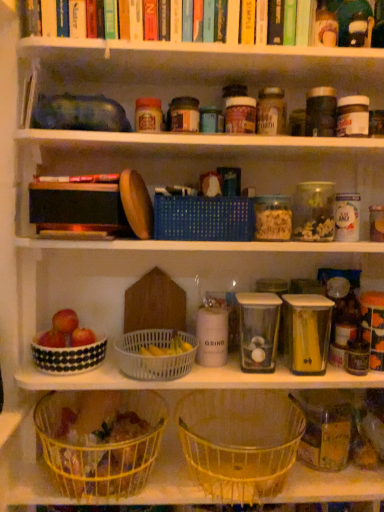
Identify the location of red matte apple at lower left, which is counted as the first apple, starting from the left. The width and height of the screenshot is (384, 512). (x=65, y=321).

What do you see at coordinates (65, 321) in the screenshot?
I see `red matte apple at lower left, which is counted as the first apple, starting from the left` at bounding box center [65, 321].

What are the coordinates of `translucent glass jar at lower right, the 1th glass jar in the right-to-left sequence` in the screenshot? It's located at (325, 428).

I want to click on white speckled ceramic bowl at lower left, so click(x=68, y=356).

The image size is (384, 512). Describe the element at coordinates (82, 337) in the screenshot. I see `red matte apple at lower left, acting as the second apple starting from the left` at that location.

Locate an element on the screen. red matte apple at lower left, arranged as the 1th apple when viewed from the right is located at coordinates (82, 337).

Locate an element on the screen. transparent plastic container at center, which is the third glass jar from right to left is located at coordinates (258, 331).

Find the location of `yellow wire basket at lower center, which ranks as the 2th basket in bottom-to-top order`. yellow wire basket at lower center, which ranks as the 2th basket in bottom-to-top order is located at coordinates (239, 441).

Could yellow wire basket at lower center, the first basket when ordered from bottom to top, be considered to be inside yellow wire basket at lower center, which ranks as the 2th basket in bottom-to-top order?

Actually, yellow wire basket at lower center, the first basket when ordered from bottom to top, is outside yellow wire basket at lower center, which ranks as the 2th basket in bottom-to-top order.

Find the location of a particular element. Image resolution: width=384 pixels, height=512 pixels. basket that is the 3rd one when counting rightward from the yellow wire basket at lower center, the first basket when ordered from bottom to top is located at coordinates (239, 441).

Considering the sizes of yellow wire basket at lower center, marked as the 3th basket in a top-to-bottom arrangement, and yellow wire basket at lower center, the first basket when ordered from bottom to top, in the image, is yellow wire basket at lower center, marked as the 3th basket in a top-to-bottom arrangement, wider or thinner than yellow wire basket at lower center, the first basket when ordered from bottom to top,?

Clearly, yellow wire basket at lower center, marked as the 3th basket in a top-to-bottom arrangement, has more width compared to yellow wire basket at lower center, the first basket when ordered from bottom to top.

From the image's perspective, is yellow wire basket at lower center, marked as the 3th basket in a top-to-bottom arrangement, beneath yellow wire basket at lower center, which ranks as the 4th basket in top-to-bottom order?

No, from the image's perspective, yellow wire basket at lower center, marked as the 3th basket in a top-to-bottom arrangement, is not beneath yellow wire basket at lower center, which ranks as the 4th basket in top-to-bottom order.

From the picture: From a real-world perspective, is white plastic basket at center, which appears as the 3th basket when ordered from the bottom, over yellow wire basket at lower center, which ranks as the 2th basket in bottom-to-top order?

Yes, from a real-world perspective, white plastic basket at center, which appears as the 3th basket when ordered from the bottom, is on top of yellow wire basket at lower center, which ranks as the 2th basket in bottom-to-top order.

Is white plastic basket at center, which appears as the 3th basket when ordered from the bottom, positioned far away from yellow wire basket at lower center, which ranks as the 2th basket in bottom-to-top order?

No, white plastic basket at center, which appears as the 3th basket when ordered from the bottom, is in close proximity to yellow wire basket at lower center, which ranks as the 2th basket in bottom-to-top order.

Which object is further away from the camera, white plastic basket at center, which appears as the 3th basket when ordered from the bottom, or yellow wire basket at lower center, which ranks as the 2th basket in bottom-to-top order?

white plastic basket at center, which appears as the 3th basket when ordered from the bottom.

From the image's perspective, starting from the yellow wire basket at lower center, which ranks as the 2th basket in bottom-to-top order, which basket is the 1st one above? Please provide its 2D coordinates.

[(153, 357)]

Looking at this image, can you confirm if red matte apple at lower left, which is counted as the first apple, starting from the left, is shorter than yellow wire basket at lower center, which ranks as the 4th basket in top-to-bottom order?

Yes, red matte apple at lower left, which is counted as the first apple, starting from the left, is shorter than yellow wire basket at lower center, which ranks as the 4th basket in top-to-bottom order.

Would you say red matte apple at lower left, which is counted as the first apple, starting from the left, is to the left or to the right of yellow wire basket at lower center, the first basket when ordered from bottom to top, in the picture?

From the image, it's evident that red matte apple at lower left, which is counted as the first apple, starting from the left, is to the left of yellow wire basket at lower center, the first basket when ordered from bottom to top.

Can yellow wire basket at lower center, the first basket when ordered from bottom to top, be found inside red matte apple at lower left, which is counted as the first apple, starting from the left?

No.

From the image's perspective, is red matte apple at lower left, which is counted as the first apple, starting from the left, positioned above or below yellow wire basket at lower center, the first basket when ordered from bottom to top?

Based on their image positions, red matte apple at lower left, which is counted as the first apple, starting from the left, is located above yellow wire basket at lower center, the first basket when ordered from bottom to top.

In the scene shown: Is transparent plastic container at center, which is the third glass jar from right to left, positioned behind clear plastic container at upper right, arranged as the 1th glass jar when viewed from the top?

Yes, the depth of transparent plastic container at center, which is the third glass jar from right to left, is greater than that of clear plastic container at upper right, arranged as the 1th glass jar when viewed from the top.

Considering the points (240, 339) and (322, 205), which point is behind, point (240, 339) or point (322, 205)?

Positioned behind is point (240, 339).

Between transparent plastic container at center, which is the third glass jar from right to left, and clear plastic container at upper right, which appears as the third glass jar when ordered from the bottom, which one has more height?

transparent plastic container at center, which is the third glass jar from right to left, is taller.

From the picture: Is transparent plastic container at center, which is the third glass jar from right to left, looking in the opposite direction of clear plastic container at upper right, acting as the second glass jar starting from the right?

No, transparent plastic container at center, which is the third glass jar from right to left,'s orientation is not away from clear plastic container at upper right, acting as the second glass jar starting from the right.

Locate an element on the screen. The image size is (384, 512). the 1st basket in front of the red matte apple at lower left, arranged as the 1th apple when viewed from the right is located at coordinates (203, 218).

Would you say red matte apple at lower left, acting as the second apple starting from the left, is inside or outside blue woven basket at center, the 4th basket from the bottom?

red matte apple at lower left, acting as the second apple starting from the left, exists outside the volume of blue woven basket at center, the 4th basket from the bottom.

From a real-world perspective, which is physically above, red matte apple at lower left, acting as the second apple starting from the left, or blue woven basket at center, the 1th basket in the top-to-bottom sequence?

blue woven basket at center, the 1th basket in the top-to-bottom sequence, is physically above.

Does red matte apple at lower left, acting as the second apple starting from the left, have a greater width compared to blue woven basket at center, the 4th basket from the bottom?

No.

Which is closer, (x=210, y=237) or (x=190, y=360)?

Positioned in front is point (x=210, y=237).

How many degrees apart are the facing directions of blue woven basket at center, the 1th basket in the top-to-bottom sequence, and white plastic basket at center, the 2th basket viewed from the top?

1.12 degrees separate the facing orientations of blue woven basket at center, the 1th basket in the top-to-bottom sequence, and white plastic basket at center, the 2th basket viewed from the top.

Based on their sizes in the image, would you say blue woven basket at center, the 4th basket from the bottom, is bigger or smaller than white plastic basket at center, the 2th basket viewed from the top?

In the image, blue woven basket at center, the 4th basket from the bottom, appears to be larger than white plastic basket at center, the 2th basket viewed from the top.

Which object is further away from the camera taking this photo, blue woven basket at center, the 1th basket in the top-to-bottom sequence, or white plastic basket at center, the 2th basket viewed from the top?

blue woven basket at center, the 1th basket in the top-to-bottom sequence, is further from the camera.

Do you think yellow wire basket at lower center, which ranks as the 2th basket in bottom-to-top order, is within transparent plastic container at center, which is counted as the 2th glass jar, starting from the top, or outside of it?

yellow wire basket at lower center, which ranks as the 2th basket in bottom-to-top order, is located beyond the bounds of transparent plastic container at center, which is counted as the 2th glass jar, starting from the top.

Considering the points (228, 497) and (241, 296), which point is behind, point (228, 497) or point (241, 296)?

Point (241, 296)

What's the angular difference between yellow wire basket at lower center, which ranks as the 2th basket in bottom-to-top order, and transparent plastic container at center, which is the third glass jar from right to left,'s facing directions?

There is a 0.000398-degree angle between the facing directions of yellow wire basket at lower center, which ranks as the 2th basket in bottom-to-top order, and transparent plastic container at center, which is the third glass jar from right to left.

Starting from the yellow wire basket at lower center, the first basket when ordered from bottom to top, which basket is the 1st one behind? Please provide its 2D coordinates.

[(239, 441)]

From the image's perspective, count 1st baskets upward from the yellow wire basket at lower center, which ranks as the 2th basket in bottom-to-top order, and point to it. Please provide its 2D coordinates.

[(153, 357)]

Based on their spatial positions, is red matte apple at lower left, the 2th apple viewed from the right, or clear plastic container at upper right, which ranks as the 2th glass jar in left-to-right order, closer to red matte apple at lower left, arranged as the 1th apple when viewed from the right?

red matte apple at lower left, the 2th apple viewed from the right.

Estimate the real-world distances between objects in this image. Which object is further from red matte apple at lower left, acting as the second apple starting from the left, white plastic basket at center, which appears as the 3th basket when ordered from the bottom, or white speckled ceramic bowl at lower left?

white plastic basket at center, which appears as the 3th basket when ordered from the bottom, is positioned further to the anchor red matte apple at lower left, acting as the second apple starting from the left.

Looking at the image, which one is located further to red matte apple at lower left, which is counted as the first apple, starting from the left, red matte apple at lower left, arranged as the 1th apple when viewed from the right, or blue woven basket at center, the 1th basket in the top-to-bottom sequence?

blue woven basket at center, the 1th basket in the top-to-bottom sequence, lies further to red matte apple at lower left, which is counted as the first apple, starting from the left, than the other object.

Looking at the image, which one is located further to yellow wire basket at lower center, which ranks as the 4th basket in top-to-bottom order, blue woven basket at center, the 4th basket from the bottom, or transparent plastic container at center, marked as the 1th glass jar in a left-to-right arrangement?

Based on the image, blue woven basket at center, the 4th basket from the bottom, appears to be further to yellow wire basket at lower center, which ranks as the 4th basket in top-to-bottom order.

Estimate the real-world distances between objects in this image. Which object is further from white plastic basket at center, which appears as the 3th basket when ordered from the bottom, transparent plastic container at center, which is counted as the 2th glass jar, starting from the top, or white speckled ceramic bowl at lower left?

transparent plastic container at center, which is counted as the 2th glass jar, starting from the top.

Considering their positions, is white speckled ceramic bowl at lower left positioned closer to blue woven basket at center, the 1th basket in the top-to-bottom sequence, than red matte apple at lower left, arranged as the 1th apple when viewed from the right?

white speckled ceramic bowl at lower left lies closer to blue woven basket at center, the 1th basket in the top-to-bottom sequence, than the other object.

Which object lies nearer to the anchor point translucent glass jar at lower right, positioned as the third glass jar in left-to-right order, red matte apple at lower left, which is counted as the first apple, starting from the left, or yellow wire basket at lower center, which ranks as the 2th basket in bottom-to-top order?

yellow wire basket at lower center, which ranks as the 2th basket in bottom-to-top order, is closer to translucent glass jar at lower right, positioned as the third glass jar in left-to-right order.

Considering their positions, is transparent plastic container at center, the 2th glass jar when ordered from bottom to top, positioned closer to blue woven basket at center, the 4th basket from the bottom, than white speckled ceramic bowl at lower left?

transparent plastic container at center, the 2th glass jar when ordered from bottom to top, is positioned closer to the anchor blue woven basket at center, the 4th basket from the bottom.

Where is `bowl that lies between red matte apple at lower left, acting as the second apple starting from the left, and yellow wire basket at lower center, which ranks as the 4th basket in top-to-bottom order, from top to bottom`? The height and width of the screenshot is (512, 384). bowl that lies between red matte apple at lower left, acting as the second apple starting from the left, and yellow wire basket at lower center, which ranks as the 4th basket in top-to-bottom order, from top to bottom is located at coordinates (68, 356).

Locate an element on the screen. Image resolution: width=384 pixels, height=512 pixels. apple between red matte apple at lower left, the 2th apple viewed from the right, and blue woven basket at center, the 4th basket from the bottom is located at coordinates (82, 337).

At what (x,y) coordinates should I click in order to perform the action: click on basket between blue woven basket at center, the 1th basket in the top-to-bottom sequence, and translucent glass jar at lower right, which appears as the first glass jar when ordered from the bottom, in the vertical direction. Please return your answer as a coordinate pair (x, y). Looking at the image, I should click on (153, 357).

Where is `bowl between blue woven basket at center, the 4th basket from the bottom, and yellow wire basket at lower center, marked as the 3th basket in a top-to-bottom arrangement, in the vertical direction`? bowl between blue woven basket at center, the 4th basket from the bottom, and yellow wire basket at lower center, marked as the 3th basket in a top-to-bottom arrangement, in the vertical direction is located at coordinates (68, 356).